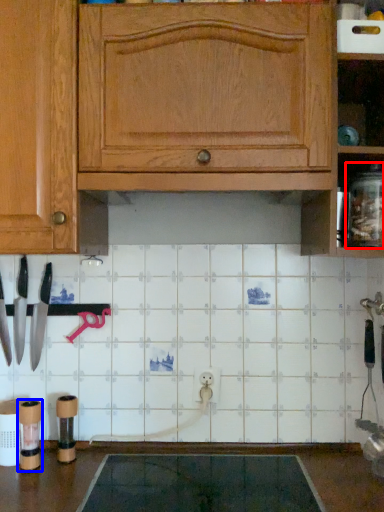
Question: Which object appears farthest to the camera in this image, glass jar (highlighted by a red box) or appliance (highlighted by a blue box)?

Choices:
 (A) glass jar
 (B) appliance

Answer: (B)